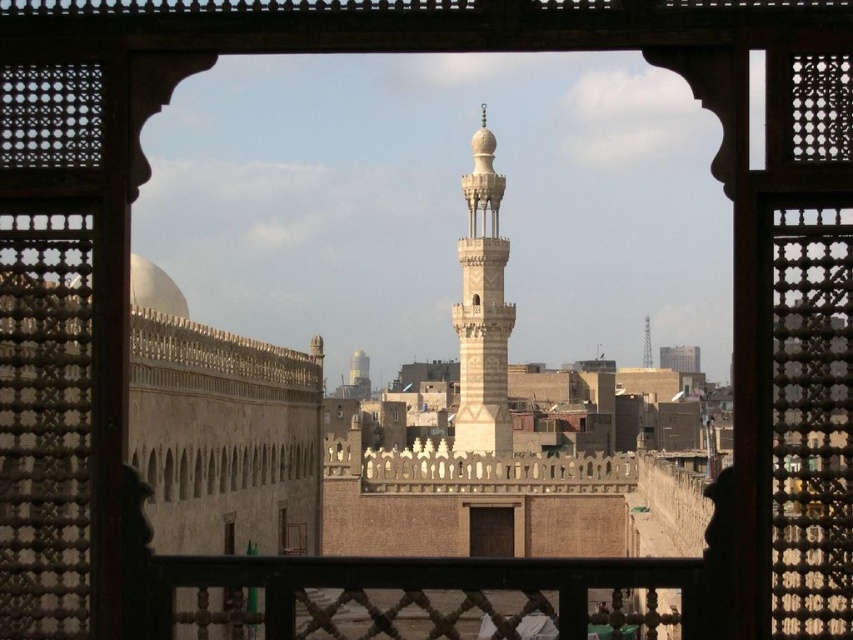
Question: Does white stone minaret at center have a larger size compared to smooth concrete tower at center?

Choices:
 (A) no
 (B) yes

Answer: (B)

Question: In this image, where is white stone minaret at center located relative to smooth concrete tower at center?

Choices:
 (A) right
 (B) left

Answer: (B)

Question: Does white stone minaret at center appear on the left side of smooth concrete tower at center?

Choices:
 (A) yes
 (B) no

Answer: (A)

Question: Which point is farther to the camera?

Choices:
 (A) white stone minaret at center
 (B) smooth concrete tower at center

Answer: (B)